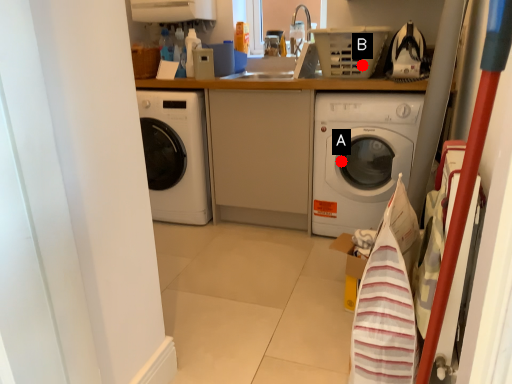
Question: Two points are circled on the image, labeled by A and B beside each circle. Which of the following is the farthest from the observer?

Choices:
 (A) A is further
 (B) B is further

Answer: (A)